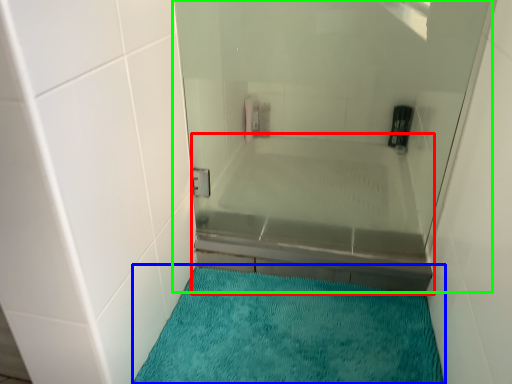
Question: Based on their relative distances, which object is farther from bathtub (highlighted by a red box)? Choose from bath mat (highlighted by a blue box) and shower door (highlighted by a green box).

Choices:
 (A) bath mat
 (B) shower door

Answer: (A)